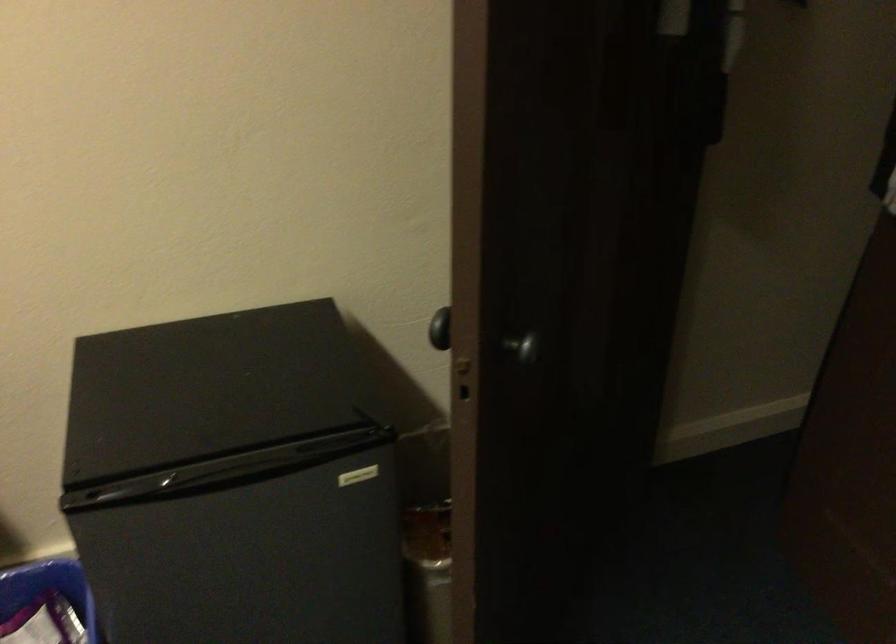
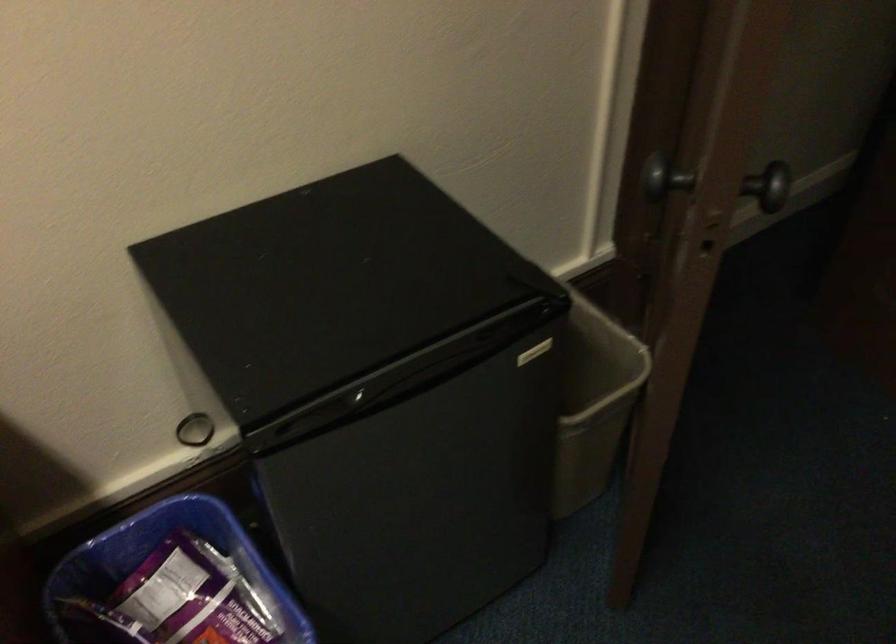
Find the pixel in the second image that matches the point at 438,321 in the first image.

(656, 174)